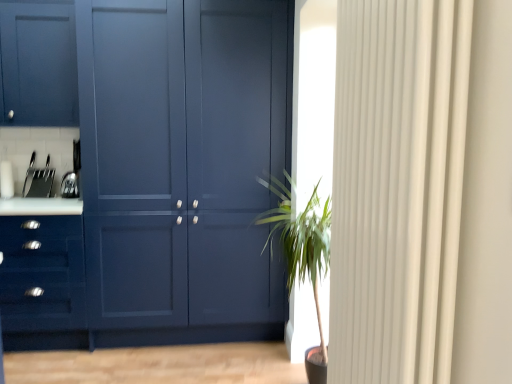
Question: From the image's perspective, is satin silver toaster at left located above matte blue drawer at left?

Choices:
 (A) no
 (B) yes

Answer: (B)

Question: Is satin silver toaster at left to the right of matte blue drawer at left from the viewer's perspective?

Choices:
 (A) yes
 (B) no

Answer: (A)

Question: Is matte blue drawer at left a part of satin silver toaster at left?

Choices:
 (A) yes
 (B) no

Answer: (B)

Question: Could you tell me if satin silver toaster at left is turned towards matte blue drawer at left?

Choices:
 (A) yes
 (B) no

Answer: (B)

Question: From a real-world perspective, does satin silver toaster at left sit lower than matte blue drawer at left?

Choices:
 (A) yes
 (B) no

Answer: (B)

Question: Considering the positions of point (64, 178) and point (309, 276), is point (64, 178) closer or farther from the camera than point (309, 276)?

Choices:
 (A) closer
 (B) farther

Answer: (B)

Question: Considering their positions, is satin silver toaster at left located in front of or behind green leafy plant at center?

Choices:
 (A) behind
 (B) front

Answer: (A)

Question: Considering the positions of satin silver toaster at left and green leafy plant at center in the image, is satin silver toaster at left wider or thinner than green leafy plant at center?

Choices:
 (A) wide
 (B) thin

Answer: (B)

Question: From the image's perspective, is satin silver toaster at left above or below green leafy plant at center?

Choices:
 (A) above
 (B) below

Answer: (A)

Question: Looking at the image, does matte blue drawer at left seem bigger or smaller compared to white textured curtain at right?

Choices:
 (A) small
 (B) big

Answer: (B)

Question: Which is correct: matte blue drawer at left is inside white textured curtain at right, or outside of it?

Choices:
 (A) inside
 (B) outside

Answer: (B)

Question: Is matte blue drawer at left to the left or to the right of white textured curtain at right in the image?

Choices:
 (A) left
 (B) right

Answer: (A)

Question: Is matte blue drawer at left taller or shorter than white textured curtain at right?

Choices:
 (A) short
 (B) tall

Answer: (A)

Question: Based on their sizes in the image, would you say white textured curtain at right is bigger or smaller than green leafy plant at center?

Choices:
 (A) small
 (B) big

Answer: (A)

Question: From the image's perspective, is white textured curtain at right positioned above or below green leafy plant at center?

Choices:
 (A) below
 (B) above

Answer: (B)